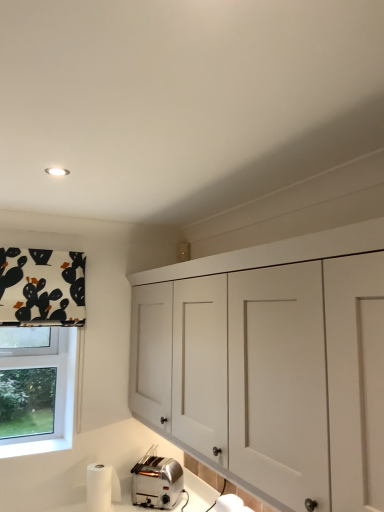
Find the location of `satin silver toaster at lower left`. satin silver toaster at lower left is located at coordinates (157, 482).

What do you see at coordinates (42, 287) in the screenshot? I see `white fabric with black and orange shapes at upper left` at bounding box center [42, 287].

The height and width of the screenshot is (512, 384). Describe the element at coordinates (271, 364) in the screenshot. I see `white matte cabinet at upper center` at that location.

Find the location of a particular element. The image size is (384, 512). satin silver toaster at lower left is located at coordinates (157, 482).

Considering the positions of point (160, 486) and point (14, 295), is point (160, 486) closer or farther from the camera than point (14, 295)?

Point (160, 486) is farther from the camera than point (14, 295).

In order to click on toaster located underneath the white fabric with black and orange shapes at upper left (from a real-world perspective) in this screenshot , I will do `click(157, 482)`.

From the image's perspective, which object appears higher, satin silver toaster at lower left or white fabric with black and orange shapes at upper left?

From the image's view, white fabric with black and orange shapes at upper left is above.

Which of these two, satin silver toaster at lower left or white fabric with black and orange shapes at upper left, stands shorter?

Standing shorter between the two is satin silver toaster at lower left.

Consider the image. Between white fabric with black and orange shapes at upper left and white matte cabinet at upper center, which one is positioned behind?

white fabric with black and orange shapes at upper left is further away from the camera.

From the image's perspective, which object appears higher, white fabric with black and orange shapes at upper left or white matte cabinet at upper center?

white fabric with black and orange shapes at upper left appears higher in the image.

I want to click on curtain lying behind the white matte cabinet at upper center, so click(42, 287).

Does point (6, 288) come farther from viewer compared to point (253, 350)?

Yes, point (6, 288) is farther from viewer.

Can you confirm if white fabric with black and orange shapes at upper left is wider than satin silver toaster at lower left?

No, white fabric with black and orange shapes at upper left is not wider than satin silver toaster at lower left.

Is white fabric with black and orange shapes at upper left in contact with satin silver toaster at lower left?

No, white fabric with black and orange shapes at upper left is not touching satin silver toaster at lower left.

Is satin silver toaster at lower left completely or partially inside white fabric with black and orange shapes at upper left?

No, satin silver toaster at lower left is not inside white fabric with black and orange shapes at upper left.

From a real-world perspective, is white fabric with black and orange shapes at upper left below satin silver toaster at lower left?

No, from a real-world perspective, white fabric with black and orange shapes at upper left is not under satin silver toaster at lower left.

Does white matte cabinet at upper center have a larger size compared to white fabric with black and orange shapes at upper left?

Yes, white matte cabinet at upper center is bigger than white fabric with black and orange shapes at upper left.

Could you measure the distance between white matte cabinet at upper center and white fabric with black and orange shapes at upper left?

white matte cabinet at upper center and white fabric with black and orange shapes at upper left are 39.14 inches apart from each other.

From the image's perspective, is white matte cabinet at upper center below white fabric with black and orange shapes at upper left?

Yes.

Which object is positioned more to the left, white matte cabinet at upper center or white fabric with black and orange shapes at upper left?

Positioned to the left is white fabric with black and orange shapes at upper left.

Does satin silver toaster at lower left touch white matte cabinet at upper center?

satin silver toaster at lower left and white matte cabinet at upper center are not in contact.

Is satin silver toaster at lower left wider than white matte cabinet at upper center?

No.

Does satin silver toaster at lower left have a larger size compared to white matte cabinet at upper center?

Incorrect, satin silver toaster at lower left is not larger than white matte cabinet at upper center.

Where is `toaster that is under the white matte cabinet at upper center (from a real-world perspective)`? This screenshot has width=384, height=512. toaster that is under the white matte cabinet at upper center (from a real-world perspective) is located at coordinates (157, 482).

Based on their positions, is white matte cabinet at upper center located to the left or right of satin silver toaster at lower left?

white matte cabinet at upper center is positioned on satin silver toaster at lower left's right side.

In the scene shown: From a real-world perspective, is white matte cabinet at upper center positioned over satin silver toaster at lower left based on gravity?

Yes.

Considering the relative sizes of white matte cabinet at upper center and satin silver toaster at lower left in the image provided, is white matte cabinet at upper center thinner than satin silver toaster at lower left?

No, white matte cabinet at upper center is not thinner than satin silver toaster at lower left.

Between white matte cabinet at upper center and satin silver toaster at lower left, which one is positioned in front?

white matte cabinet at upper center is more forward.

The height and width of the screenshot is (512, 384). Identify the location of toaster located behind the white fabric with black and orange shapes at upper left. (157, 482).

The width and height of the screenshot is (384, 512). I want to click on curtain on the left of the white matte cabinet at upper center, so click(x=42, y=287).

Consider the image. Considering their positions, is satin silver toaster at lower left positioned closer to white matte cabinet at upper center than white fabric with black and orange shapes at upper left?

satin silver toaster at lower left.

Considering their positions, is white fabric with black and orange shapes at upper left positioned closer to white matte cabinet at upper center than satin silver toaster at lower left?

satin silver toaster at lower left.

Based on their spatial positions, is white matte cabinet at upper center or white fabric with black and orange shapes at upper left closer to satin silver toaster at lower left?

Based on the image, white matte cabinet at upper center appears to be nearer to satin silver toaster at lower left.

From the image, which object appears to be farther from white fabric with black and orange shapes at upper left, white matte cabinet at upper center or satin silver toaster at lower left?

The object further to white fabric with black and orange shapes at upper left is satin silver toaster at lower left.

Considering their positions, is satin silver toaster at lower left positioned further to white fabric with black and orange shapes at upper left than white matte cabinet at upper center?

satin silver toaster at lower left lies further to white fabric with black and orange shapes at upper left than the other object.

From the picture: When comparing their distances from satin silver toaster at lower left, does white fabric with black and orange shapes at upper left or white matte cabinet at upper center seem closer?

white matte cabinet at upper center.

You are a GUI agent. You are given a task and a screenshot of the screen. Output one action in this format:
    pyautogui.click(x=<x>, y=<y>)
    Task: Click on the curtain between white matte cabinet at upper center and satin silver toaster at lower left in the front-back direction
    This screenshot has height=512, width=384.
    Given the screenshot: What is the action you would take?
    pyautogui.click(x=42, y=287)